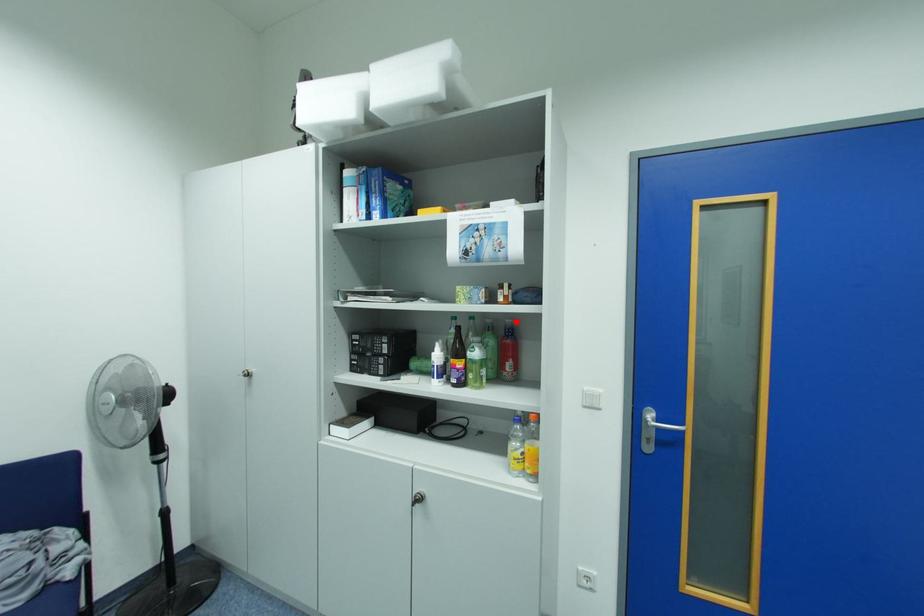
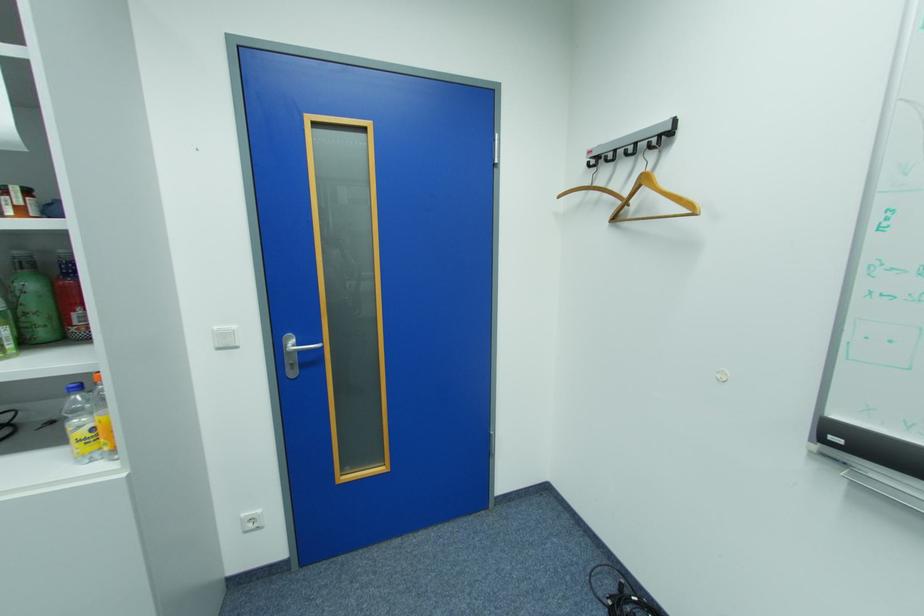
Where in the second image is the point corresponding to the highlighted location from the first image?

(69, 252)